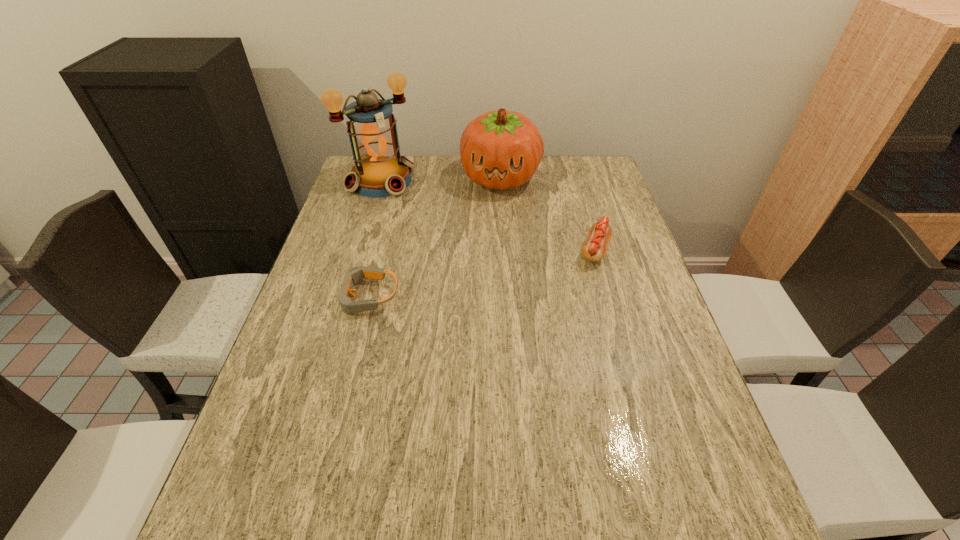
This screenshot has width=960, height=540. I want to click on the shortest object, so click(x=355, y=274).

Identify the location of the nearest object. The image size is (960, 540). (355, 274).

I want to click on the rightmost object, so pyautogui.click(x=594, y=249).

Image resolution: width=960 pixels, height=540 pixels. What are the coordinates of `the second nearest object` in the screenshot? It's located at (594, 249).

Where is `pumpkin`? The height and width of the screenshot is (540, 960). pumpkin is located at coordinates (501, 149).

You are a GUI agent. You are given a task and a screenshot of the screen. Output one action in this format:
    pyautogui.click(x=<x>, y=<y>)
    Task: Click on the second tallest object
    The height and width of the screenshot is (540, 960).
    Given the screenshot: What is the action you would take?
    pyautogui.click(x=501, y=149)

You are a GUI agent. You are given a task and a screenshot of the screen. Output one action in this format:
    pyautogui.click(x=<x>, y=<y>)
    Task: Click on the lantern
    The width and height of the screenshot is (960, 540).
    Given the screenshot: What is the action you would take?
    pyautogui.click(x=379, y=171)

This screenshot has height=540, width=960. Find the location of `vacant space located on the front and back of the goggles`. vacant space located on the front and back of the goggles is located at coordinates (308, 296).

This screenshot has height=540, width=960. Find the location of `free location located on the front and back of the goggles`. free location located on the front and back of the goggles is located at coordinates (304, 296).

Identify the location of vacant space located on the front and back of the goggles. This screenshot has width=960, height=540. (317, 296).